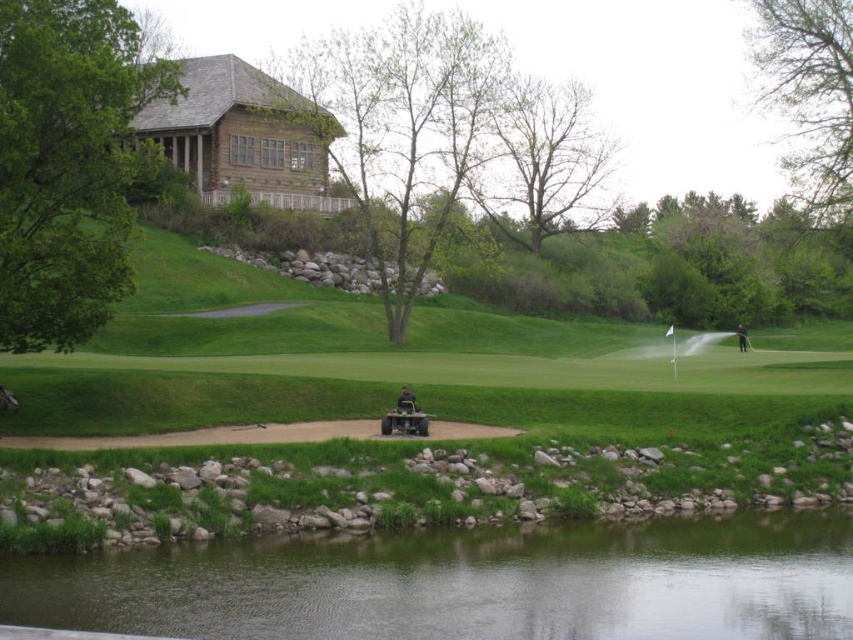
Can you confirm if transparent water at lower center is shorter than green fabric shirt at center?

Yes, transparent water at lower center is shorter than green fabric shirt at center.

Is transparent water at lower center bigger than green fabric shirt at center?

Indeed, transparent water at lower center has a larger size compared to green fabric shirt at center.

I want to click on transparent water at lower center, so click(x=467, y=582).

Locate an element on the screen. Image resolution: width=853 pixels, height=640 pixels. transparent water at lower center is located at coordinates [x=467, y=582].